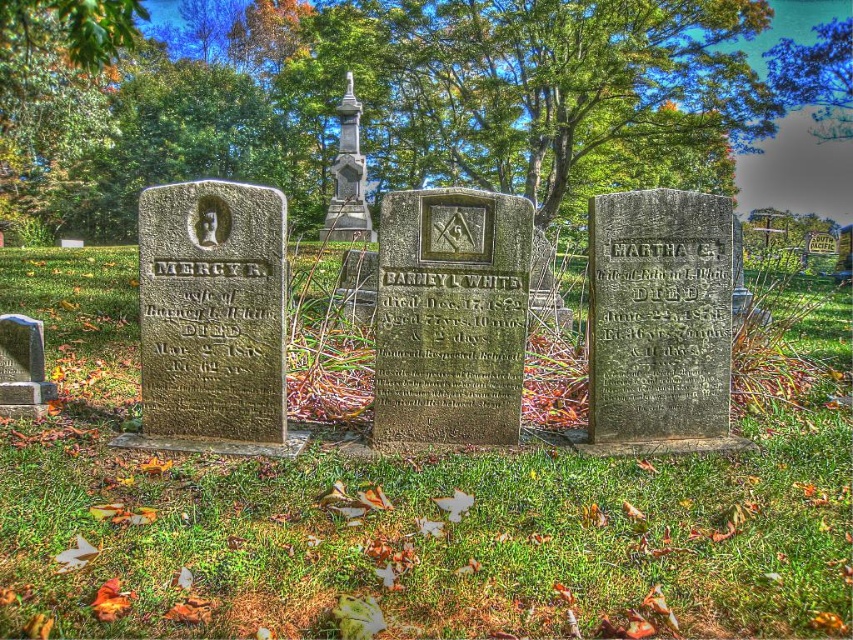
Does green stone gravestone at left have a larger size compared to polished stone monument at center?

Actually, green stone gravestone at left might be smaller than polished stone monument at center.

Does green stone gravestone at left appear under polished stone monument at center?

Yes.

In the scene shown: Who is more forward, (x=218, y=253) or (x=341, y=129)?

Point (x=218, y=253) is in front.

The image size is (853, 640). I want to click on green stone gravestone at left, so click(212, 310).

Based on the photo, is green grass at center positioned before green stone gravestone at left?

That is True.

Who is positioned more to the right, green grass at center or green stone gravestone at left?

green grass at center is more to the right.

Is point (688, 564) in front of point (212, 355)?

Yes.

Find the location of a particular element. This screenshot has height=640, width=853. green grass at center is located at coordinates (392, 513).

Is dark gray stone gravestone at right positioned before polished stone monument at center?

That is True.

Which is below, dark gray stone gravestone at right or polished stone monument at center?

dark gray stone gravestone at right is lower down.

The image size is (853, 640). What are the coordinates of `dark gray stone gravestone at right` in the screenshot? It's located at (659, 316).